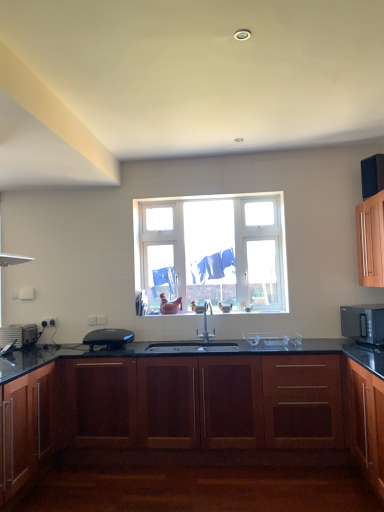
Question: From a real-world perspective, is mahogany wood cabinet at lower right, the 2th cabinetry viewed from the right, physically above silver metallic faucet at center?

Choices:
 (A) yes
 (B) no

Answer: (B)

Question: Considering the relative positions of mahogany wood cabinet at lower right, the 2th cabinetry viewed from the right, and silver metallic faucet at center in the image provided, is mahogany wood cabinet at lower right, the 2th cabinetry viewed from the right, to the left of silver metallic faucet at center from the viewer's perspective?

Choices:
 (A) no
 (B) yes

Answer: (A)

Question: From the image's perspective, is mahogany wood cabinet at lower right, the 2th cabinetry viewed from the right, located beneath silver metallic faucet at center?

Choices:
 (A) no
 (B) yes

Answer: (B)

Question: Is mahogany wood cabinet at lower right, the 2th cabinetry viewed from the right, shorter than silver metallic faucet at center?

Choices:
 (A) no
 (B) yes

Answer: (A)

Question: Is mahogany wood cabinet at lower right, positioned as the second cabinetry in left-to-right order, taller than silver metallic faucet at center?

Choices:
 (A) no
 (B) yes

Answer: (B)

Question: Is mahogany wood cabinet at lower right, positioned as the second cabinetry in left-to-right order, behind silver metallic faucet at center?

Choices:
 (A) no
 (B) yes

Answer: (A)

Question: From a real-world perspective, is black plastic toaster at center, marked as the second appliance in a left-to-right arrangement, located higher than mahogany wood cabinet at center, which appears as the 1th cabinetry when viewed from the left?

Choices:
 (A) yes
 (B) no

Answer: (A)

Question: Is black plastic toaster at center, which is the 1th appliance in right-to-left order, thinner than mahogany wood cabinet at center, which ranks as the 3th cabinetry in right-to-left order?

Choices:
 (A) yes
 (B) no

Answer: (A)

Question: Is black plastic toaster at center, which is the 1th appliance in right-to-left order, facing away from mahogany wood cabinet at center, which appears as the 1th cabinetry when viewed from the left?

Choices:
 (A) yes
 (B) no

Answer: (B)

Question: Considering the relative positions of black plastic toaster at center, which is the 1th appliance in right-to-left order, and mahogany wood cabinet at center, which appears as the 1th cabinetry when viewed from the left, in the image provided, is black plastic toaster at center, which is the 1th appliance in right-to-left order, behind mahogany wood cabinet at center, which appears as the 1th cabinetry when viewed from the left,?

Choices:
 (A) no
 (B) yes

Answer: (B)

Question: Is black plastic toaster at center, marked as the second appliance in a left-to-right arrangement, closer to camera compared to mahogany wood cabinet at center, which appears as the 1th cabinetry when viewed from the left?

Choices:
 (A) no
 (B) yes

Answer: (A)

Question: From a real-world perspective, is black plastic toaster at center, marked as the second appliance in a left-to-right arrangement, below mahogany wood cabinet at center, which ranks as the 3th cabinetry in right-to-left order?

Choices:
 (A) yes
 (B) no

Answer: (B)

Question: Does cabinet at right, the third cabinetry from the left, have a smaller size compared to silver metallic toaster at left, which appears as the 1th appliance when viewed from the left?

Choices:
 (A) yes
 (B) no

Answer: (B)